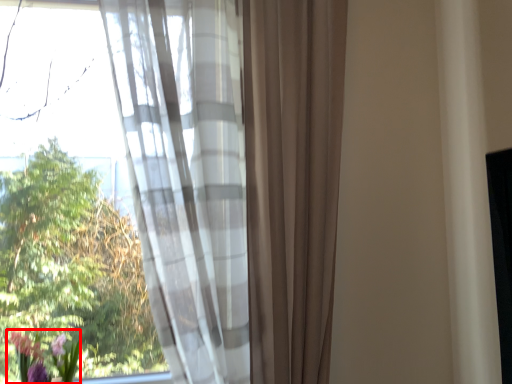
Question: From the image's perspective, what is the correct spatial positioning of floral arrangement (annotated by the red box) in reference to curtain?

Choices:
 (A) below
 (B) above

Answer: (A)